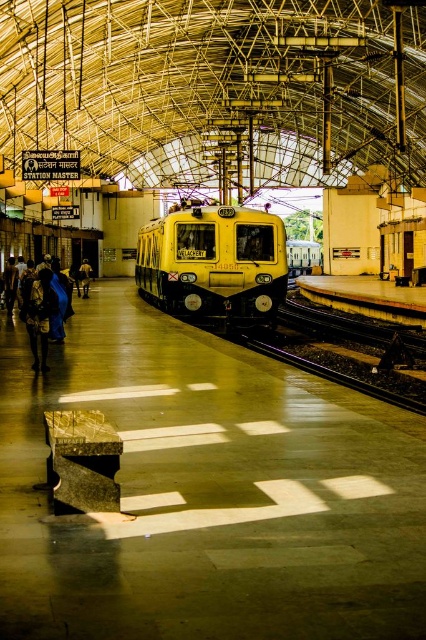
Who is more forward, (186, 209) or (388, 368)?

Positioned in front is point (388, 368).

Is point (238, 269) in front of point (403, 392)?

No, (238, 269) is further to viewer.

Image resolution: width=426 pixels, height=640 pixels. I want to click on yellow matte train at center, so click(213, 262).

Does black metal train track at lower center appear on the left side of dark blue fabric at left?

No, black metal train track at lower center is not to the left of dark blue fabric at left.

Where is `black metal train track at lower center`? Image resolution: width=426 pixels, height=640 pixels. black metal train track at lower center is located at coordinates (345, 355).

Is yellow matte train at center to the right of dark blue fabric at left from the viewer's perspective?

Indeed, yellow matte train at center is positioned on the right side of dark blue fabric at left.

Between yellow matte train at center and dark blue fabric at left, which one has less height?

Standing shorter between the two is dark blue fabric at left.

The image size is (426, 640). Identify the location of yellow matte train at center. pos(213,262).

Find the location of a particular element. yellow matte train at center is located at coordinates (213, 262).